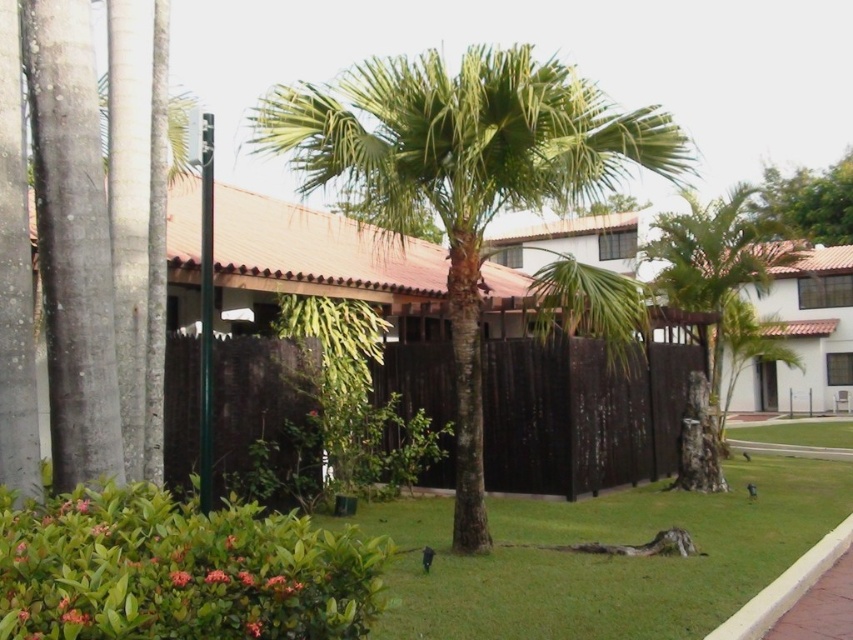
Question: Can you confirm if brown wood fence at center is positioned to the right of green leafy tree at upper right?

Choices:
 (A) no
 (B) yes

Answer: (A)

Question: Can you confirm if green grass at center is positioned below brown wood fence at center?

Choices:
 (A) no
 (B) yes

Answer: (B)

Question: Is green grass at center below brown wood fence at center?

Choices:
 (A) yes
 (B) no

Answer: (A)

Question: Considering the real-world distances, which object is farthest from the brown wood fence at center?

Choices:
 (A) green leafy tree at upper right
 (B) green grass at center

Answer: (A)

Question: Which object is the farthest from the brown wood fence at center?

Choices:
 (A) green leafy tree at upper right
 (B) green leafy palm tree at center
 (C) green grass at center

Answer: (A)

Question: Considering the real-world distances, which object is closest to the green leafy tree at upper right?

Choices:
 (A) green leafy palm tree at center
 (B) green grass at center
 (C) brown wood fence at center

Answer: (A)